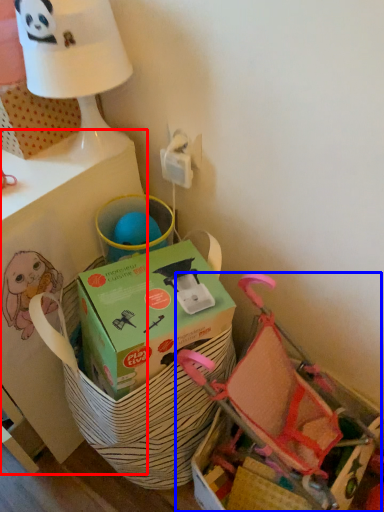
Question: Which object appears closest to the camera in this image, table (highlighted by a red box) or baby carriage (highlighted by a blue box)?

Choices:
 (A) table
 (B) baby carriage

Answer: (A)